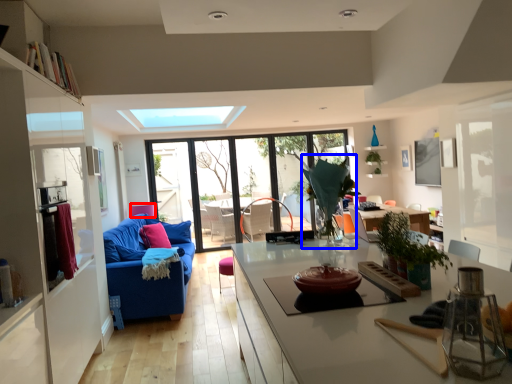
Question: Which object is closer to the camera taking this photo, armchair (highlighted by a red box) or plant (highlighted by a blue box)?

Choices:
 (A) armchair
 (B) plant

Answer: (B)